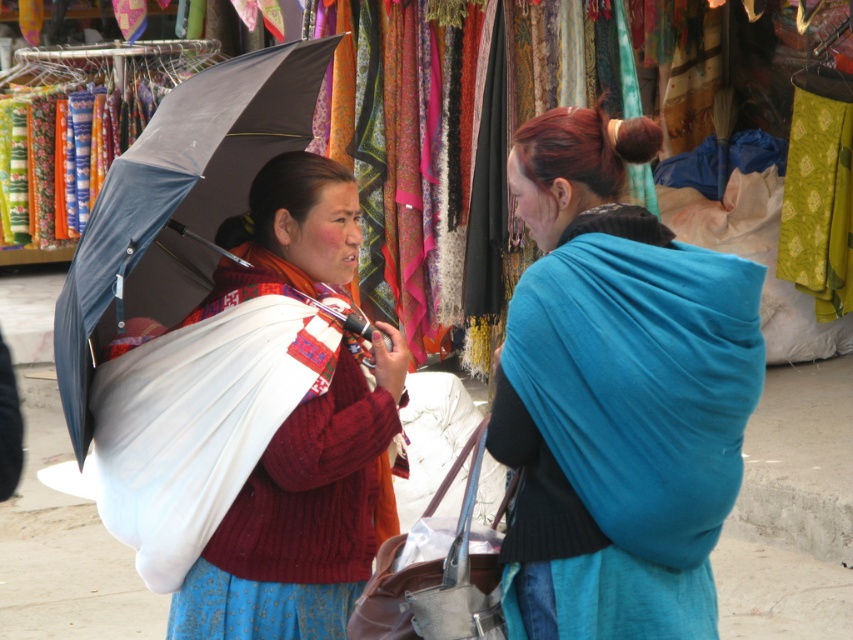
Can you confirm if matte blue shawl at center is shorter than matte white shawl at center?

Yes, matte blue shawl at center is shorter than matte white shawl at center.

Does point (537, 474) lie in front of point (277, 579)?

Yes, it is.

The height and width of the screenshot is (640, 853). I want to click on matte blue shawl at center, so click(616, 396).

Who is higher up, matte blue shawl at center or dark gray fabric umbrella at left?

dark gray fabric umbrella at left is higher up.

Who is more forward, [596,316] or [173,305]?

Point [596,316] is more forward.

At what (x,y) coordinates should I click in order to perform the action: click on matte blue shawl at center. Please return your answer as a coordinate pair (x, y). This screenshot has height=640, width=853. Looking at the image, I should click on (616, 396).

Is matte white shawl at center behind dark gray fabric umbrella at left?

That is True.

Who is shorter, matte white shawl at center or dark gray fabric umbrella at left?

Standing shorter between the two is dark gray fabric umbrella at left.

Where is `matte white shawl at center`? This screenshot has height=640, width=853. matte white shawl at center is located at coordinates (305, 513).